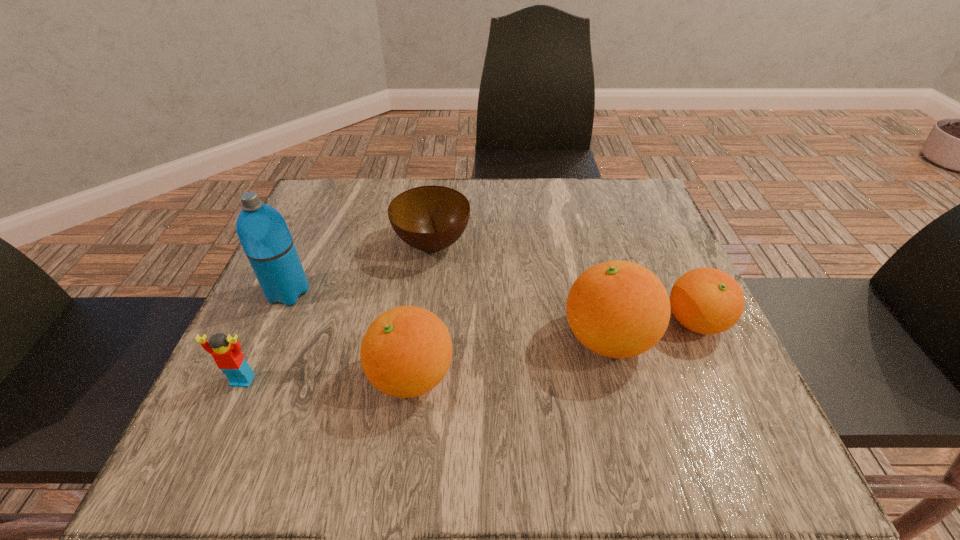
The width and height of the screenshot is (960, 540). I want to click on vacant area located on the left of the second orange from left to right, so click(461, 339).

Image resolution: width=960 pixels, height=540 pixels. In order to click on vacant space located 0.280m on the left of the rightmost object in this screenshot , I will do `click(520, 322)`.

This screenshot has width=960, height=540. Find the location of `free space located 0.260m on the front of the shortest object`. free space located 0.260m on the front of the shortest object is located at coordinates (418, 370).

Locate an element on the screen. free space located on the right of the thermos bottle is located at coordinates (386, 292).

Image resolution: width=960 pixels, height=540 pixels. I want to click on vacant region located on the face of the Lego, so click(x=228, y=414).

This screenshot has width=960, height=540. Identify the location of object located in the far edge section of the desktop. (429, 218).

The width and height of the screenshot is (960, 540). What are the coordinates of `Lego that is at the near edge` in the screenshot? It's located at (228, 357).

I want to click on thermos bottle that is at the left edge, so click(264, 235).

Locate an element on the screen. This screenshot has height=540, width=960. Lego at the left edge is located at coordinates (228, 357).

Where is `object that is positioned at the near left corner`? object that is positioned at the near left corner is located at coordinates (228, 357).